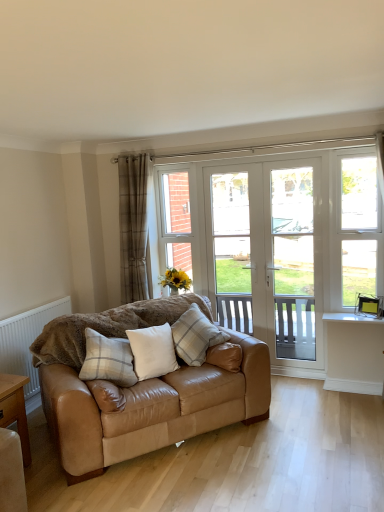
Question: Is white plastic window at right wider than light brown wooden table at lower left?

Choices:
 (A) no
 (B) yes

Answer: (A)

Question: Could you tell me if white plastic window at right is facing light brown wooden table at lower left?

Choices:
 (A) no
 (B) yes

Answer: (A)

Question: Is white plastic window at right behind light brown wooden table at lower left?

Choices:
 (A) no
 (B) yes

Answer: (B)

Question: Is white plastic window at right not near light brown wooden table at lower left?

Choices:
 (A) yes
 (B) no

Answer: (A)

Question: From a real-world perspective, is white plastic window at right under light brown wooden table at lower left?

Choices:
 (A) no
 (B) yes

Answer: (A)

Question: Which is correct: white plastic screen door at center, the first screen door when ordered from right to left, is inside plaid fabric pillow at center, the first pillow viewed from the right, or outside of it?

Choices:
 (A) outside
 (B) inside

Answer: (A)

Question: Looking at their shapes, would you say white plastic screen door at center, the first screen door when ordered from right to left, is wider or thinner than plaid fabric pillow at center, positioned as the 3th pillow in left-to-right order?

Choices:
 (A) wide
 (B) thin

Answer: (B)

Question: Based on their positions, is white plastic screen door at center, the 2th screen door viewed from the left, located to the left or right of plaid fabric pillow at center, the first pillow viewed from the right?

Choices:
 (A) left
 (B) right

Answer: (B)

Question: From their relative heights in the image, would you say white plastic screen door at center, the first screen door when ordered from right to left, is taller or shorter than plaid fabric pillow at center, the first pillow viewed from the right?

Choices:
 (A) tall
 (B) short

Answer: (A)

Question: Considering the relative positions of white glass screen door at center, positioned as the first screen door in left-to-right order, and white plastic window at right in the image provided, is white glass screen door at center, positioned as the first screen door in left-to-right order, to the left or to the right of white plastic window at right?

Choices:
 (A) left
 (B) right

Answer: (A)

Question: Is white glass screen door at center, acting as the second screen door starting from the right, inside the boundaries of white plastic window at right, or outside?

Choices:
 (A) inside
 (B) outside

Answer: (B)

Question: Is point (288, 251) positioned closer to the camera than point (355, 181)?

Choices:
 (A) farther
 (B) closer

Answer: (A)

Question: From the image's perspective, relative to white plastic window at right, is white glass screen door at center, acting as the second screen door starting from the right, above or below?

Choices:
 (A) above
 (B) below

Answer: (B)

Question: Is point (135, 211) closer or farther from the camera than point (289, 330)?

Choices:
 (A) farther
 (B) closer

Answer: (B)

Question: Is plaid fabric curtain at left inside the boundaries of white glass screen door at center, positioned as the first screen door in left-to-right order, or outside?

Choices:
 (A) outside
 (B) inside

Answer: (A)